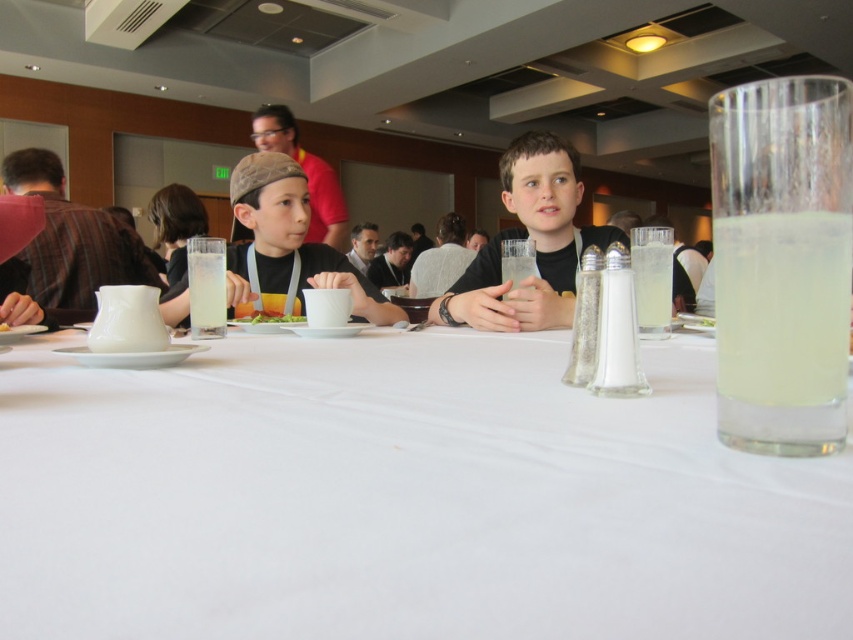
Question: Is matte brown cap at center positioned before clear glass at center?

Choices:
 (A) yes
 (B) no

Answer: (B)

Question: Based on their relative distances, which object is nearer to the yellow translucent liquid at right?

Choices:
 (A) clear glass at upper right
 (B) white fabric table at center

Answer: (B)

Question: From the image, what is the correct spatial relationship of matte brown cap at center in relation to clear glass at center?

Choices:
 (A) right
 (B) left

Answer: (B)

Question: Among these points, which one is nearest to the camera?

Choices:
 (A) (260, 316)
 (B) (215, 259)
 (C) (722, 266)

Answer: (C)

Question: Does white fabric table at center appear on the left side of green leafy salad at center?

Choices:
 (A) yes
 (B) no

Answer: (B)

Question: Which of the following is the closest to the observer?

Choices:
 (A) clear glass at center
 (B) matte black cap at center
 (C) yellow translucent liquid at right

Answer: (C)